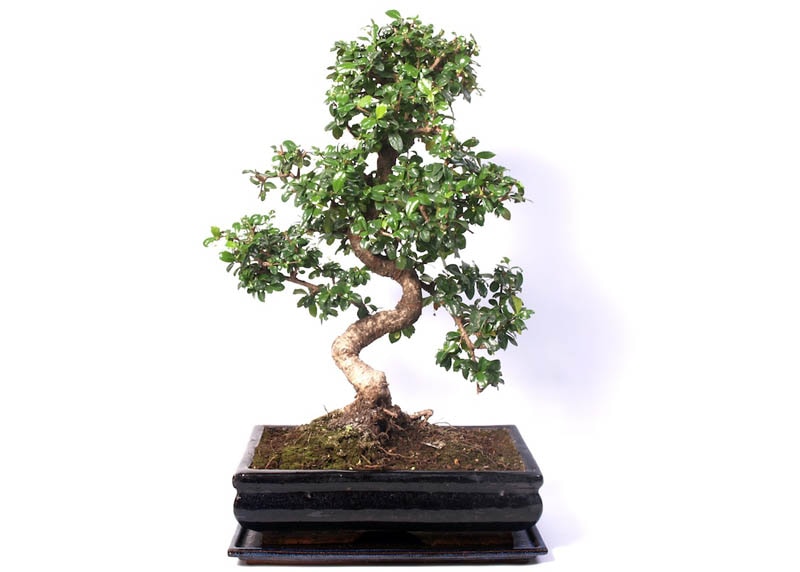
Find the location of a particular element. The height and width of the screenshot is (572, 800). planter is located at coordinates (374, 506).